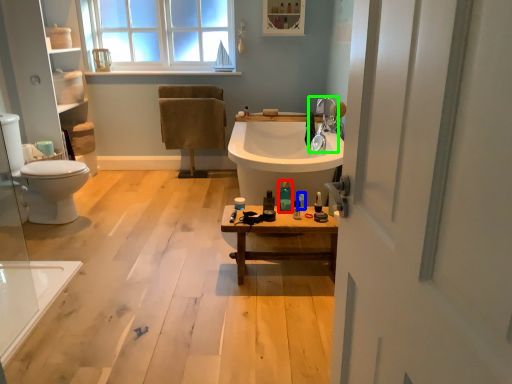
Question: Based on their relative distances, which object is farther from toiletry (highlighted by a red box)? Choose from toiletry (highlighted by a blue box) and tap (highlighted by a green box).

Choices:
 (A) toiletry
 (B) tap

Answer: (B)